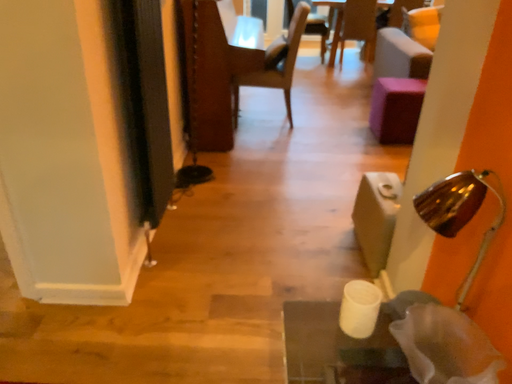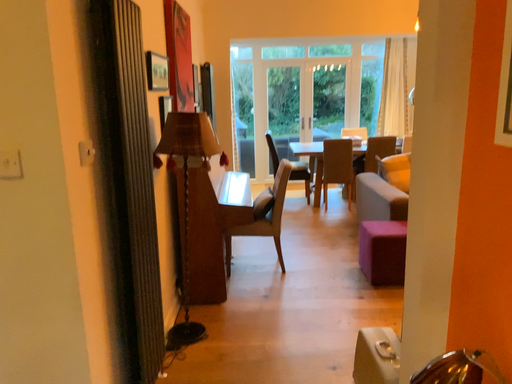
Question: Which way did the camera rotate in the video?

Choices:
 (A) rotated downward
 (B) rotated upward

Answer: (B)